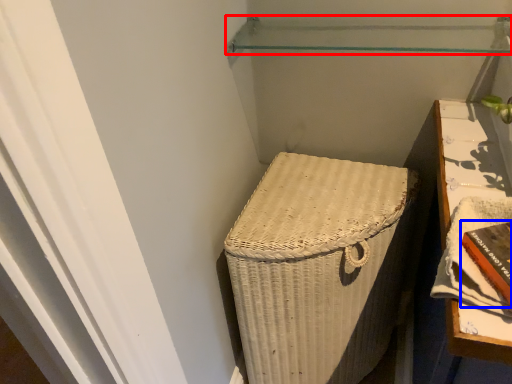
Question: Which of the following is the closest to the observer, shelf (highlighted by a red box) or book (highlighted by a blue box)?

Choices:
 (A) shelf
 (B) book

Answer: (B)